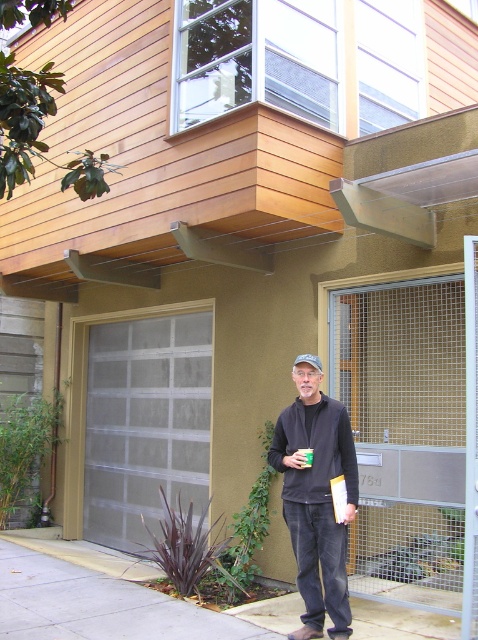
Question: Does gray textured garage door at center have a smaller size compared to black matte jacket at center?

Choices:
 (A) yes
 (B) no

Answer: (B)

Question: Which of the following is the farthest from the observer?

Choices:
 (A) black matte jacket at center
 (B) gray textured garage door at center

Answer: (B)

Question: Can you confirm if gray textured garage door at center is positioned to the right of black matte jacket at center?

Choices:
 (A) no
 (B) yes

Answer: (A)

Question: Among these objects, which one is farthest from the camera?

Choices:
 (A) black matte jacket at center
 (B) gray textured garage door at center

Answer: (B)

Question: Can you confirm if gray textured garage door at center is positioned above black matte jacket at center?

Choices:
 (A) no
 (B) yes

Answer: (B)

Question: Which of the following is the closest to the observer?

Choices:
 (A) gray textured garage door at center
 (B) black matte jacket at center

Answer: (B)